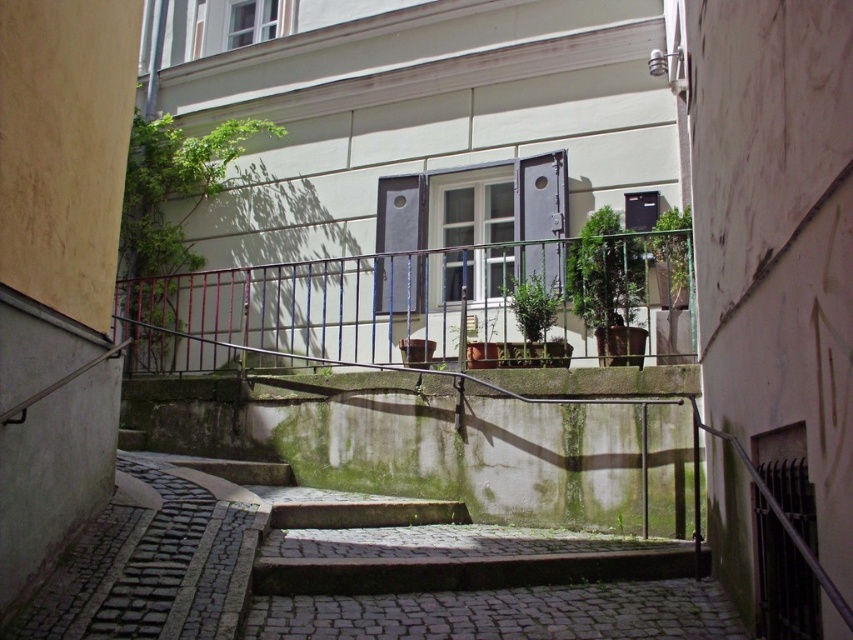
Question: Which of the following is the farthest from the observer?

Choices:
 (A) green leafy plant at left
 (B) green leafy plant at upper center

Answer: (A)

Question: Observing the image, what is the correct spatial positioning of green leafy plant at center in reference to green leafy plant at upper center?

Choices:
 (A) above
 (B) below

Answer: (A)

Question: Is green leafy plant at center smaller than green matte plant at center?

Choices:
 (A) no
 (B) yes

Answer: (A)

Question: Which object is positioned closest to the green leafy plant at center?

Choices:
 (A) green leafy plant at upper center
 (B) green matte plant at center
 (C) green leafy plant at left

Answer: (A)

Question: Considering the real-world distances, which object is closest to the green matte plant at center?

Choices:
 (A) green leafy plant at upper center
 (B) green leafy plant at center
 (C) green leafy plant at left

Answer: (B)

Question: From the image, what is the correct spatial relationship of green leafy plant at left in relation to green matte plant at center?

Choices:
 (A) below
 (B) above

Answer: (B)